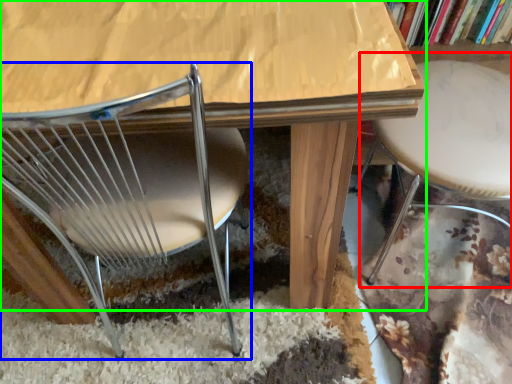
Question: Which object is the farthest from bar stool (highlighted by a red box)? Choose among these: chair (highlighted by a blue box) or table (highlighted by a green box).

Choices:
 (A) chair
 (B) table

Answer: (A)